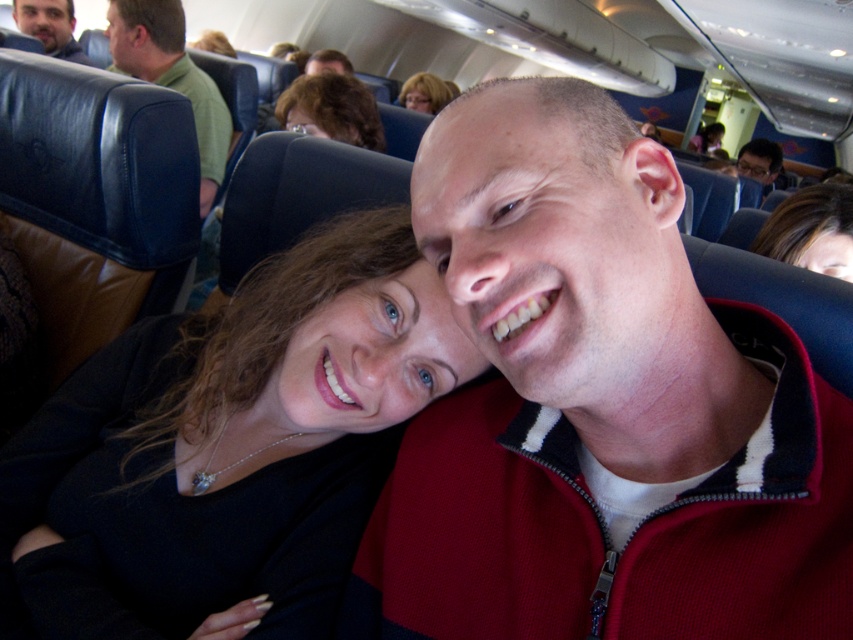
Question: Among these points, which one is farthest from the camera?

Choices:
 (A) (769, 144)
 (B) (502, 186)
 (C) (42, 29)

Answer: (A)

Question: Is smooth brown hair at upper right in front of matte black hair at upper center?

Choices:
 (A) no
 (B) yes

Answer: (B)

Question: Can you confirm if green matte chair at upper left is positioned above matte green shirt at upper left?

Choices:
 (A) yes
 (B) no

Answer: (B)

Question: Which object appears closest to the camera in this image?

Choices:
 (A) black matte sweater at center
 (B) matte black hair at upper center

Answer: (A)

Question: Is smooth brown hair at upper right positioned before blonde hair at upper center?

Choices:
 (A) no
 (B) yes

Answer: (B)

Question: Which point is closer to the camera taking this photo?

Choices:
 (A) (108, 29)
 (B) (796, 259)

Answer: (B)